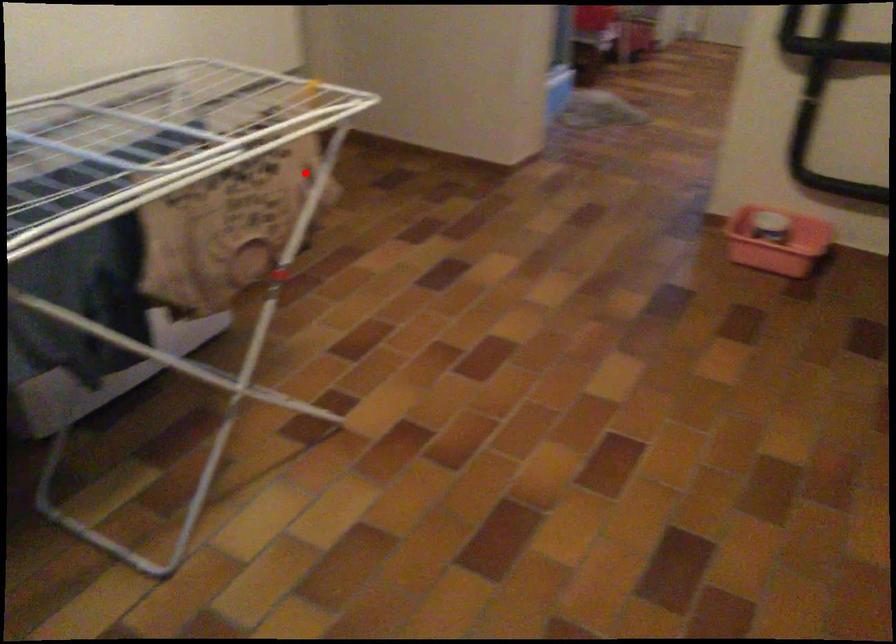
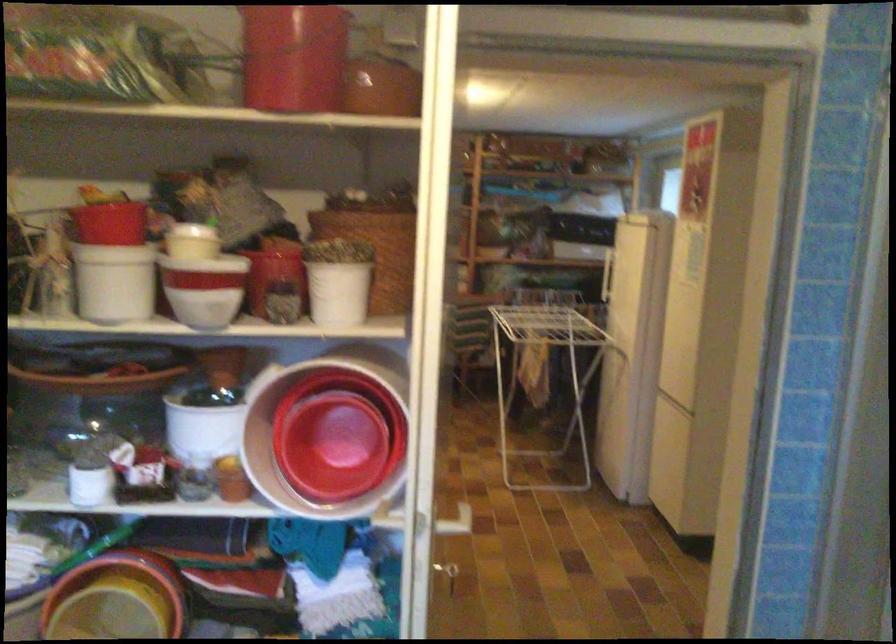
Question: I am providing you with two images of the same scene from different viewpoints. A red point is shown in image1. For the corresponding object point in image2, is it positioned nearer or farther from the camera?

Choices:
 (A) Nearer
 (B) Farther

Answer: (B)